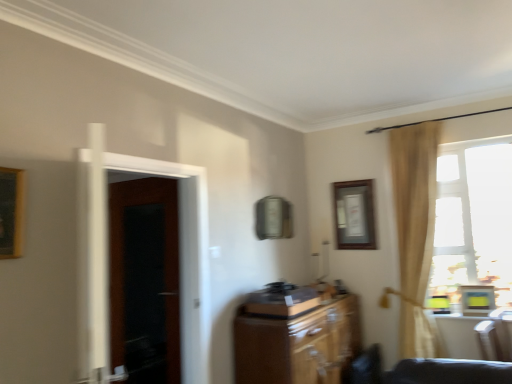
Question: From a real-world perspective, is wooden cabinet at center positioned over transparent glass window at right based on gravity?

Choices:
 (A) yes
 (B) no

Answer: (B)

Question: Is wooden cabinet at center turned away from transparent glass window at right?

Choices:
 (A) yes
 (B) no

Answer: (B)

Question: Is wooden cabinet at center aimed at transparent glass window at right?

Choices:
 (A) yes
 (B) no

Answer: (B)

Question: Is wooden cabinet at center to the left of transparent glass window at right from the viewer's perspective?

Choices:
 (A) no
 (B) yes

Answer: (B)

Question: Would you say wooden cabinet at center contains transparent glass window at right?

Choices:
 (A) yes
 (B) no

Answer: (B)

Question: Considering the relative sizes of wooden cabinet at center and transparent glass window at right in the image provided, is wooden cabinet at center thinner than transparent glass window at right?

Choices:
 (A) no
 (B) yes

Answer: (A)

Question: Is dark wood door at left looking in the opposite direction of wooden record player at center?

Choices:
 (A) yes
 (B) no

Answer: (B)

Question: Is dark wood door at left further to the viewer compared to wooden record player at center?

Choices:
 (A) no
 (B) yes

Answer: (B)

Question: From the image's perspective, is dark wood door at left located above wooden record player at center?

Choices:
 (A) no
 (B) yes

Answer: (B)

Question: Does dark wood door at left have a smaller size compared to wooden record player at center?

Choices:
 (A) yes
 (B) no

Answer: (B)

Question: Is dark wood door at left positioned in front of wooden record player at center?

Choices:
 (A) yes
 (B) no

Answer: (B)

Question: Is dark wood door at left at the right side of wooden record player at center?

Choices:
 (A) yes
 (B) no

Answer: (B)

Question: From a real-world perspective, is wooden record player at center positioned under wooden picture frame at upper center based on gravity?

Choices:
 (A) no
 (B) yes

Answer: (B)